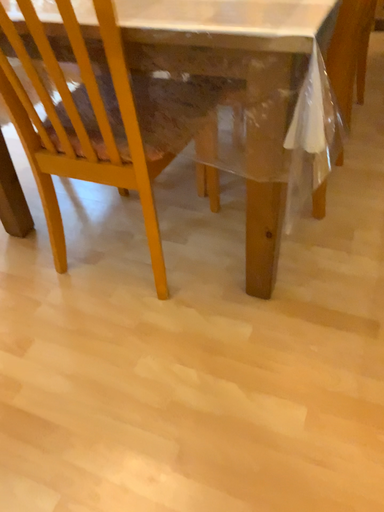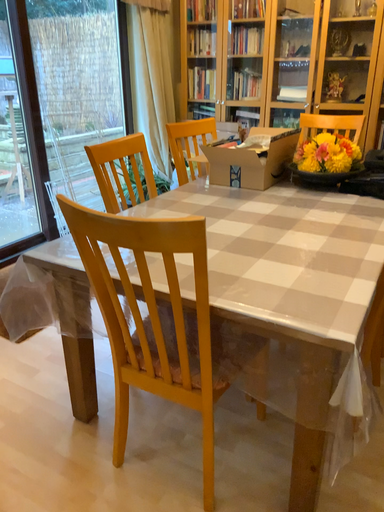
Question: How did the camera likely rotate when shooting the video?

Choices:
 (A) rotated upward
 (B) rotated downward

Answer: (A)